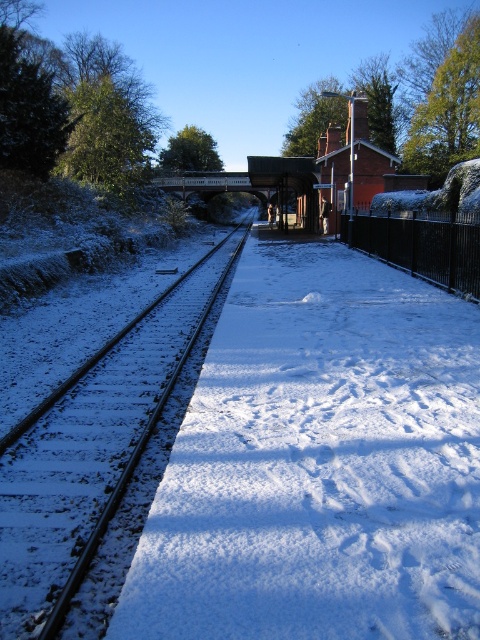
Does snow-covered metal track at center come in front of black metal fence at right?

Yes.

Who is more distant from viewer, (x=103, y=384) or (x=471, y=253)?

Point (x=471, y=253)

Which is behind, point (135, 376) or point (404, 244)?

Point (404, 244)

Identify the location of snow-covered metal track at center. Image resolution: width=480 pixels, height=640 pixels. (91, 451).